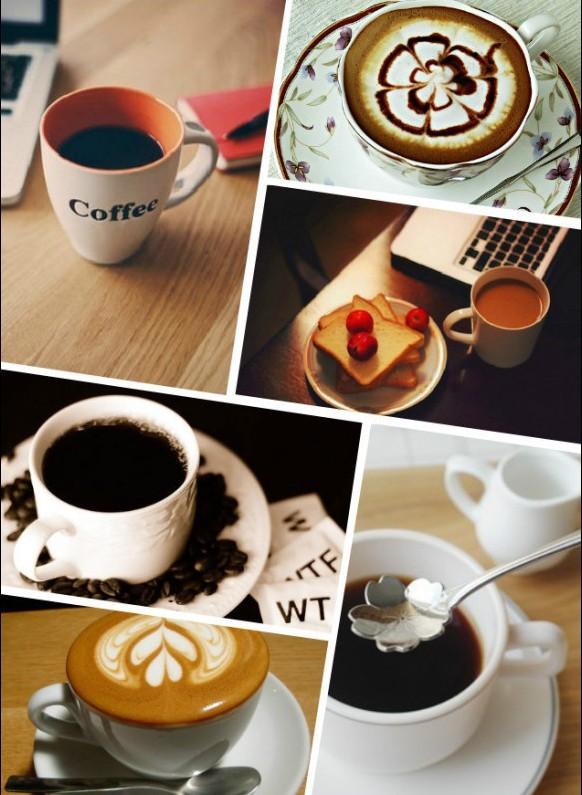
Locate an element on the screen. The image size is (582, 795). cups is located at coordinates click(212, 746), click(340, 724), click(161, 524), click(450, 165), click(486, 330), click(119, 207).